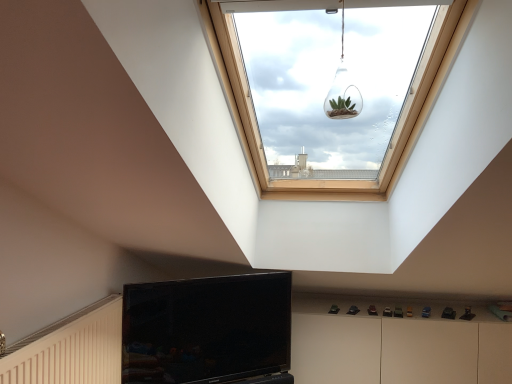
Question: From a real-world perspective, is clear glass terrarium at upper center on white glossy dresser at lower right?

Choices:
 (A) no
 (B) yes

Answer: (B)

Question: Is clear glass terrarium at upper center closer to the viewer compared to white glossy dresser at lower right?

Choices:
 (A) yes
 (B) no

Answer: (A)

Question: Is clear glass terrarium at upper center to the left of white glossy dresser at lower right from the viewer's perspective?

Choices:
 (A) no
 (B) yes

Answer: (B)

Question: From the image's perspective, is clear glass terrarium at upper center located beneath white glossy dresser at lower right?

Choices:
 (A) no
 (B) yes

Answer: (A)

Question: Considering the relative positions of clear glass terrarium at upper center and white glossy dresser at lower right in the image provided, is clear glass terrarium at upper center to the right of white glossy dresser at lower right from the viewer's perspective?

Choices:
 (A) no
 (B) yes

Answer: (A)

Question: Looking at their shapes, would you say clear glass terrarium at upper center is wider or thinner than black glossy tv at lower center?

Choices:
 (A) wide
 (B) thin

Answer: (B)

Question: Is clear glass terrarium at upper center situated inside black glossy tv at lower center or outside?

Choices:
 (A) outside
 (B) inside

Answer: (A)

Question: In terms of height, does clear glass terrarium at upper center look taller or shorter compared to black glossy tv at lower center?

Choices:
 (A) short
 (B) tall

Answer: (A)

Question: Is clear glass terrarium at upper center in front of or behind black glossy tv at lower center in the image?

Choices:
 (A) front
 (B) behind

Answer: (A)

Question: Relative to white glossy dresser at lower right, is black glossy tv at lower center in front or behind?

Choices:
 (A) front
 (B) behind

Answer: (A)

Question: Looking at their shapes, would you say black glossy tv at lower center is wider or thinner than white glossy dresser at lower right?

Choices:
 (A) wide
 (B) thin

Answer: (B)

Question: Is point (233, 372) positioned closer to the camera than point (400, 334)?

Choices:
 (A) closer
 (B) farther

Answer: (A)

Question: In terms of size, does black glossy tv at lower center appear bigger or smaller than white glossy dresser at lower right?

Choices:
 (A) big
 (B) small

Answer: (B)

Question: Is point (419, 311) positioned closer to the camera than point (280, 296)?

Choices:
 (A) closer
 (B) farther

Answer: (B)

Question: In terms of width, does white glossy dresser at lower right look wider or thinner when compared to black glossy tv at lower center?

Choices:
 (A) wide
 (B) thin

Answer: (A)